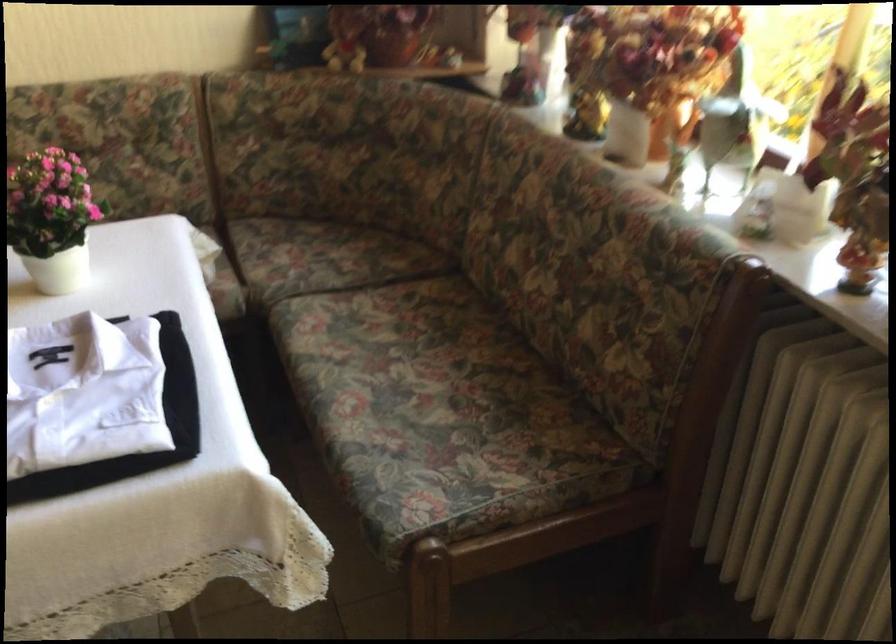
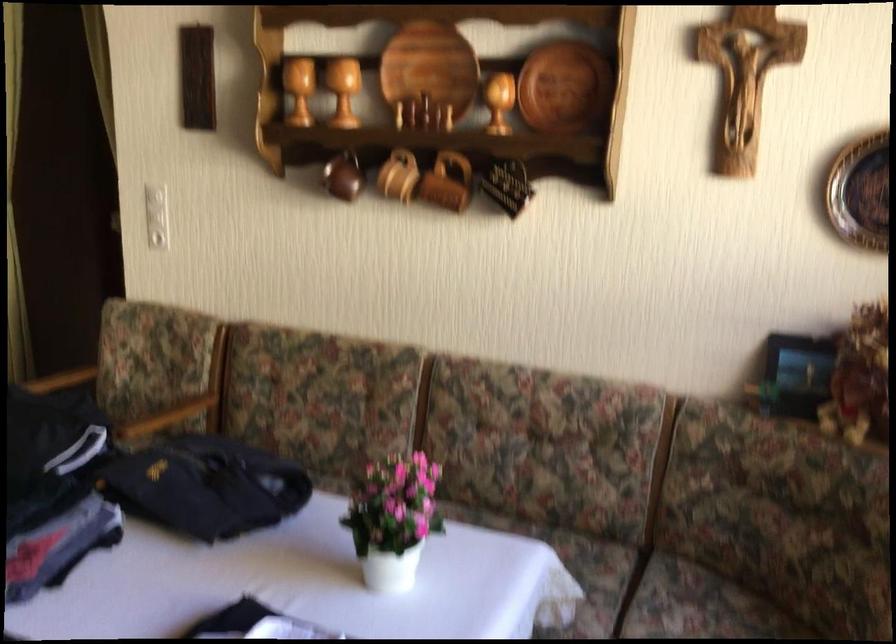
Question: The images are taken continuously from a first-person perspective. In which direction is your viewpoint rotating?

Choices:
 (A) Left
 (B) Right
 (C) Up
 (D) Down

Answer: (A)